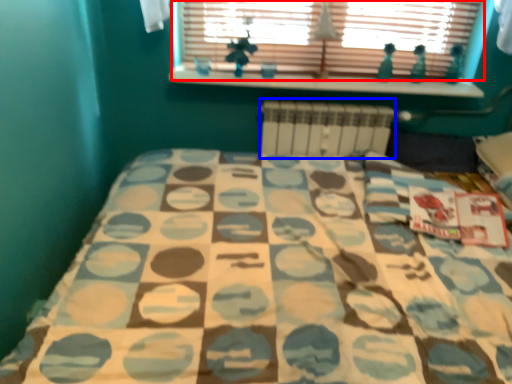
Question: Among these objects, which one is farthest to the camera, window (highlighted by a red box) or radiator (highlighted by a blue box)?

Choices:
 (A) window
 (B) radiator

Answer: (B)